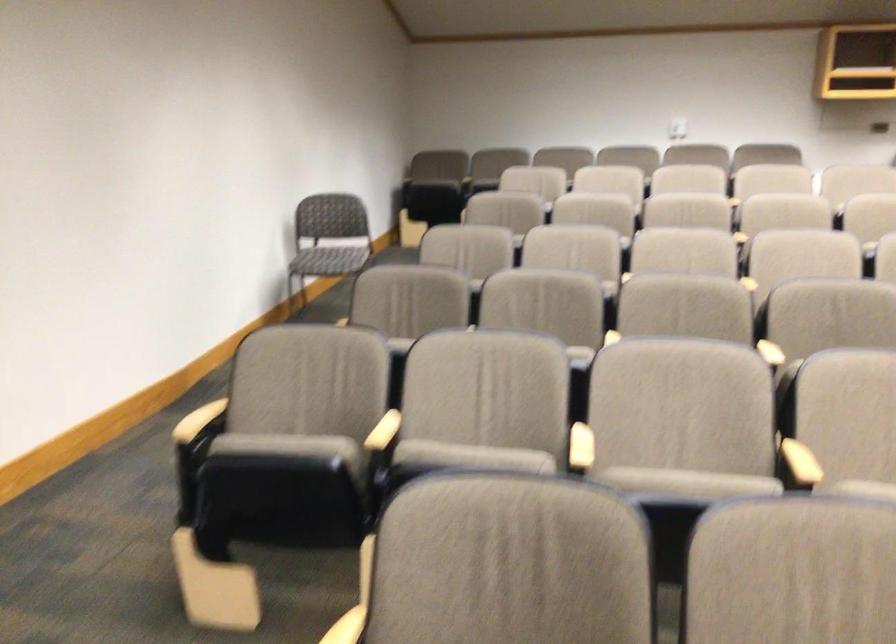
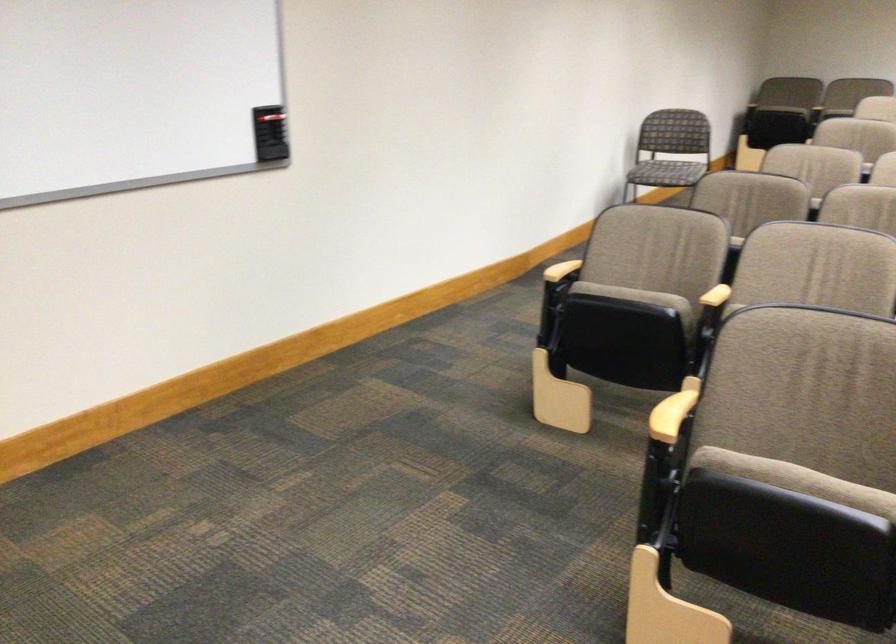
Find the pixel in the second image that matches the point at 377,453 in the first image.

(716, 297)